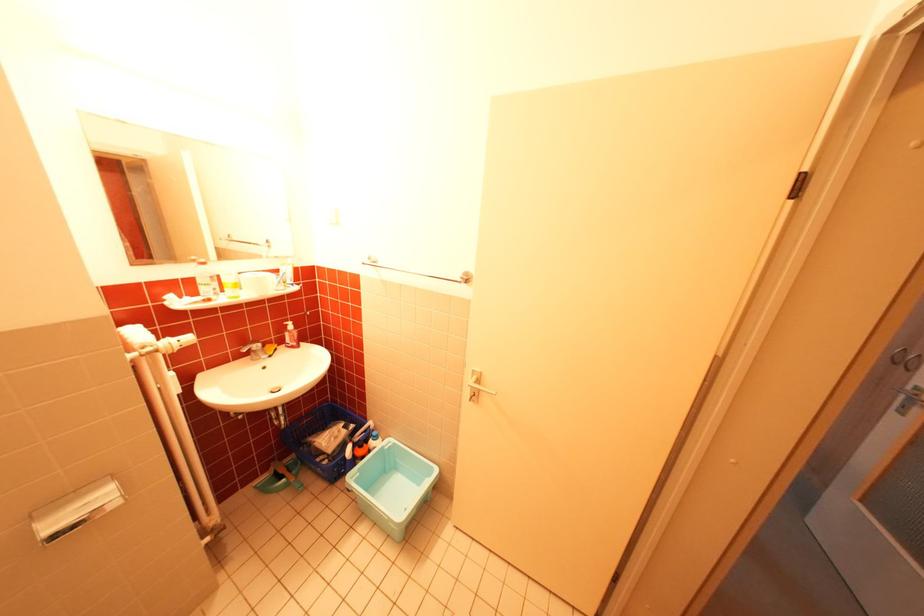
Describe the element at coordinates (254, 350) in the screenshot. The height and width of the screenshot is (616, 924). I see `the faucet lever handle` at that location.